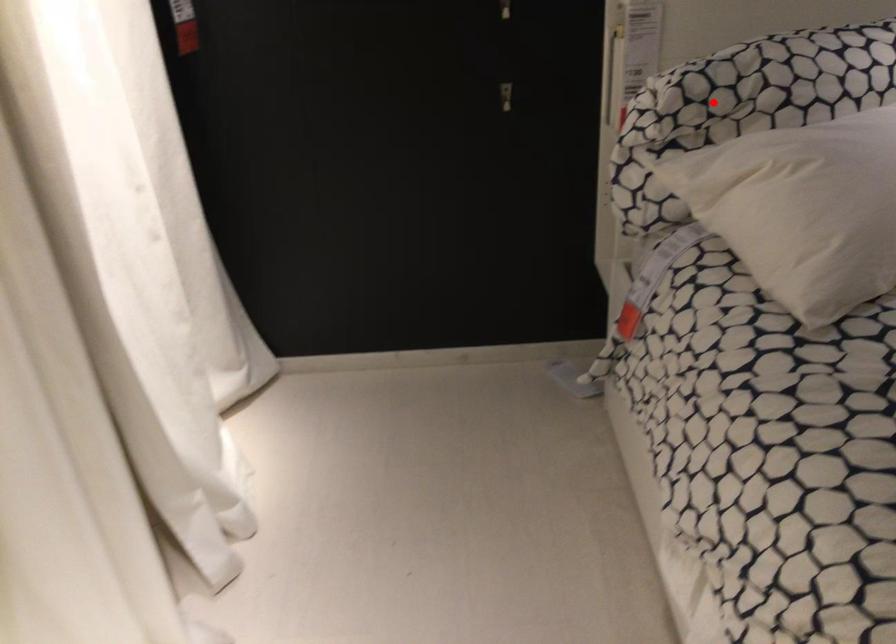
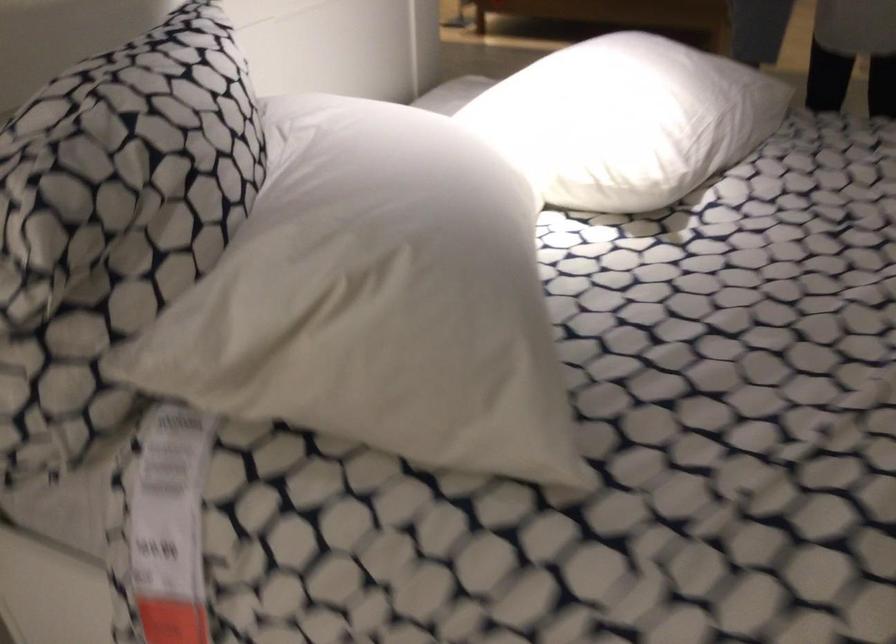
In the second image, find the point that corresponds to the highlighted location in the first image.

(116, 205)